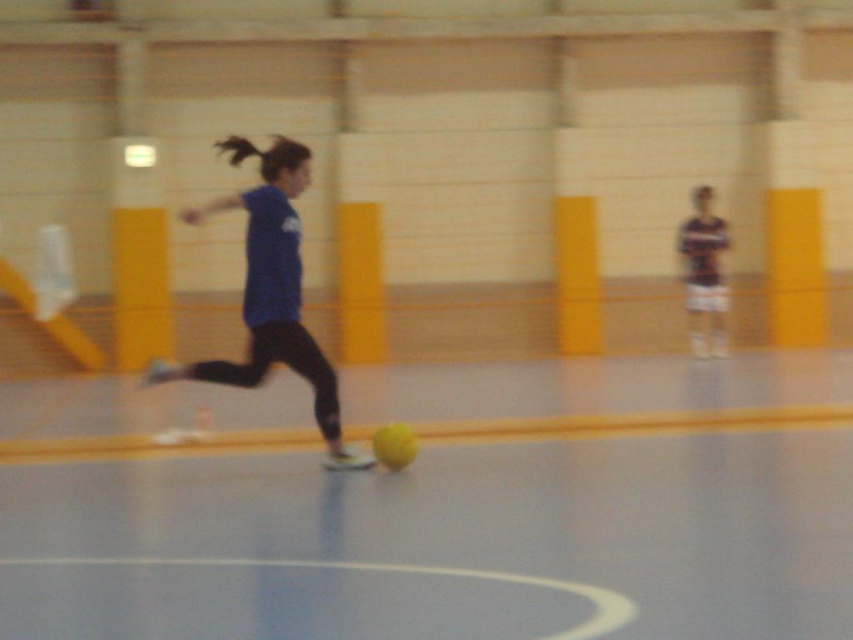
You are a referee in the sports facility and need to determine if the yellow rubber ball at center is wider than the blue matte shirt at center. Based on the description, can you confirm this?

The yellow rubber ball at center is wider than the blue matte shirt at center according to the provided description.

Based on the photo, you are a referee observing the game in the indoor sports facility. You notice the yellow rubber ball at center and the blue matte shirt at center. Based on their positions, can you determine which object is closer to the wall with vertical yellow and white stripes in the background?

The yellow rubber ball at center is in front of the blue matte shirt at center. Since the wall with vertical yellow and white stripes is in the background, the object closer to the wall would be the blue matte shirt at center because it is behind the ball.

You are a referee in the sports facility and need to determine if the yellow rubber ball at center is within the playing area. The ball must be at least 3 meters away from the blue matte shirt at center to be considered out of bounds. Based on the description, is the ball within the playing area?

The yellow rubber ball at center and blue matte shirt at center are 2.88 meters apart. Since the required distance for the ball to be out of bounds is 3 meters, the ball is still within the playing area as it hasn not reached that distance.